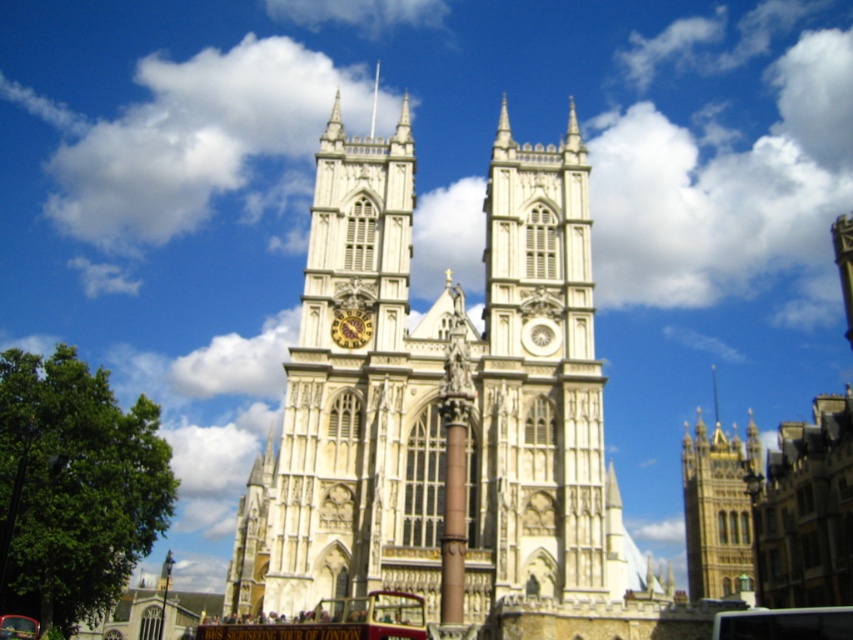
Question: Among these objects, which one is farthest from the camera?

Choices:
 (A) red painted wooden bus at lower center
 (B) white stone tower at center
 (C) white stone church at center
 (D) white stone clock tower at center

Answer: (D)

Question: Which is nearer to the red painted wooden bus at lower center?

Choices:
 (A) white stone clock tower at center
 (B) white stone tower at center

Answer: (A)

Question: Is white stone church at center closer to camera compared to white stone clock tower at center?

Choices:
 (A) yes
 (B) no

Answer: (A)

Question: Does white stone clock tower at center come in front of red painted wooden bus at lower center?

Choices:
 (A) yes
 (B) no

Answer: (B)

Question: Which point appears farthest from the camera in this image?

Choices:
 (A) coord(397,454)
 (B) coord(593,468)

Answer: (A)

Question: Does white stone church at center have a greater width compared to gold textured clock at center?

Choices:
 (A) no
 (B) yes

Answer: (B)